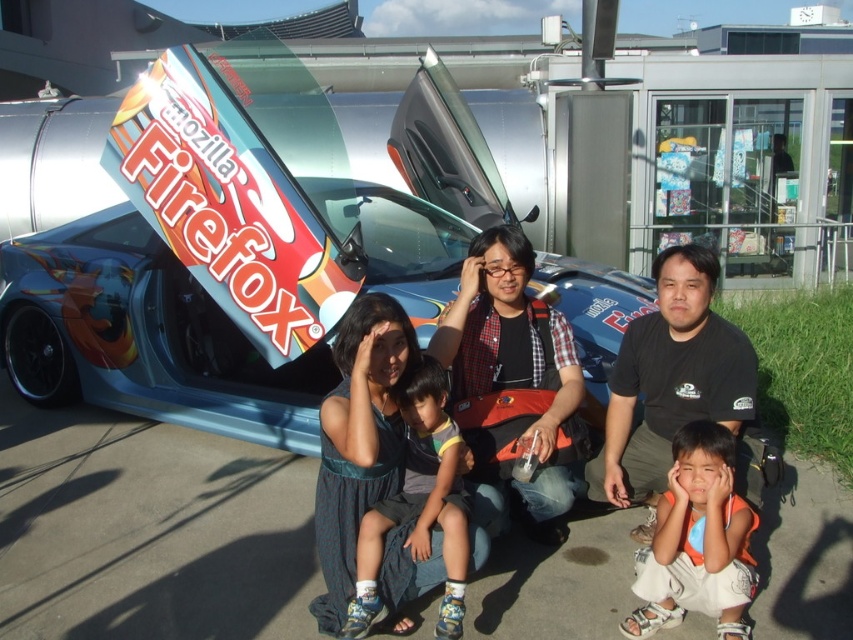
Can you confirm if matte black life vest at center is thinner than blue denim shorts at center?

No, matte black life vest at center is not thinner than blue denim shorts at center.

Does matte black life vest at center have a larger size compared to blue denim shorts at center?

Yes.

Is point (469, 262) behind point (366, 547)?

Yes, point (469, 262) is behind point (366, 547).

I want to click on matte black life vest at center, so click(514, 365).

Between orange t-shirt at lower right and blue denim shorts at center, which one is positioned lower?

Positioned lower is orange t-shirt at lower right.

I want to click on orange t-shirt at lower right, so click(697, 541).

Which is more to the left, shiny metallic car at center or orange t-shirt at lower right?

Positioned to the left is shiny metallic car at center.

Does shiny metallic car at center have a larger size compared to orange t-shirt at lower right?

Correct, shiny metallic car at center is larger in size than orange t-shirt at lower right.

Find the location of a particular element. shiny metallic car at center is located at coordinates (x=236, y=234).

Identify the location of shiny metallic car at center. (236, 234).